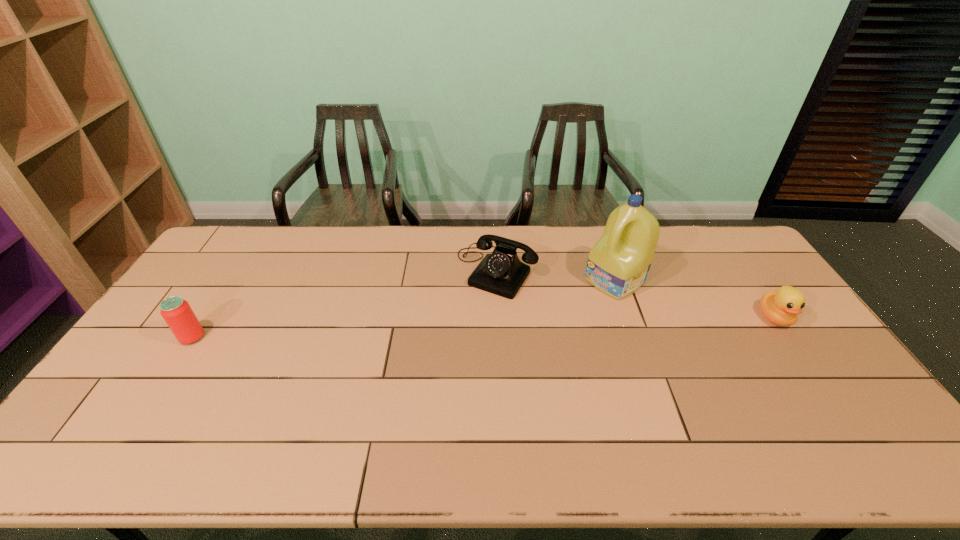
Identify the location of the leftmost object. The image size is (960, 540). (177, 313).

Identify the location of the rightmost object. Image resolution: width=960 pixels, height=540 pixels. (781, 307).

Where is `the second object from right to left`? Image resolution: width=960 pixels, height=540 pixels. the second object from right to left is located at coordinates (618, 265).

Find the location of a particular element. The height and width of the screenshot is (540, 960). detergent is located at coordinates 618,265.

Where is `telephone`? telephone is located at coordinates (502, 273).

Locate an element on the screen. vacant space located on the back of the beer can is located at coordinates (219, 296).

Locate an element on the screen. free region located on the face of the duckling is located at coordinates (812, 372).

This screenshot has height=540, width=960. Identify the location of free spot located on the label of the detergent. tap(510, 353).

I want to click on free region located 0.370m on the label of the detergent, so click(513, 351).

This screenshot has width=960, height=540. Find the location of `vacant area located 0.120m on the label of the detergent`. vacant area located 0.120m on the label of the detergent is located at coordinates (570, 310).